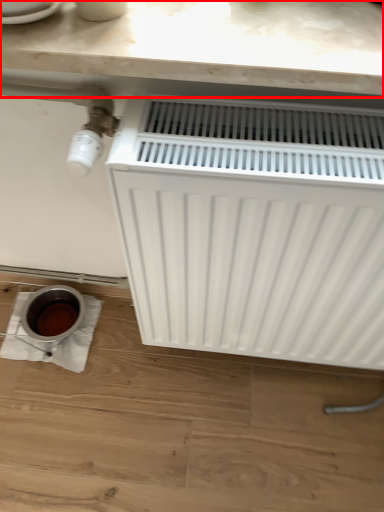
Question: From the image's perspective, what is the correct spatial positioning of counter top (annotated by the red box) in reference to radiator?

Choices:
 (A) above
 (B) below

Answer: (A)